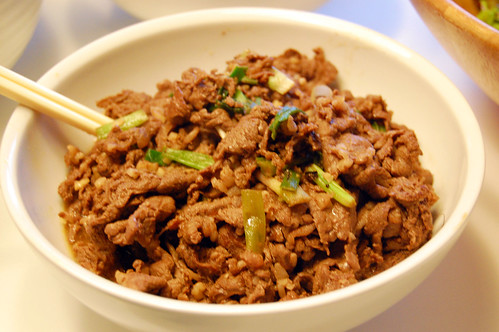
Locate an element on the screen. The width and height of the screenshot is (499, 332). chopstick is located at coordinates (76, 117), (78, 110).